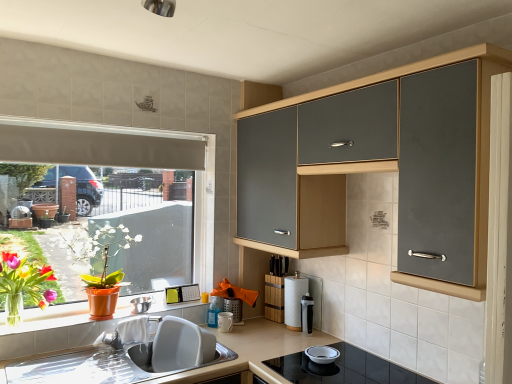
This screenshot has width=512, height=384. Identify the location of free space in front of white paper towel at center, the fifth appliance when ordered from left to right. (284, 344).